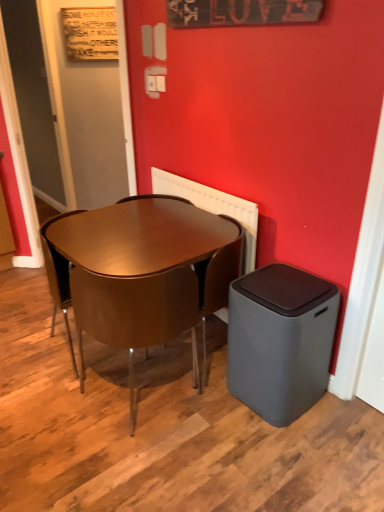
Locate an element on the screen. The image size is (384, 512). vacant area that is in front of glossy brown chair at center, which is counted as the 1th chair, starting from the left is located at coordinates (56, 397).